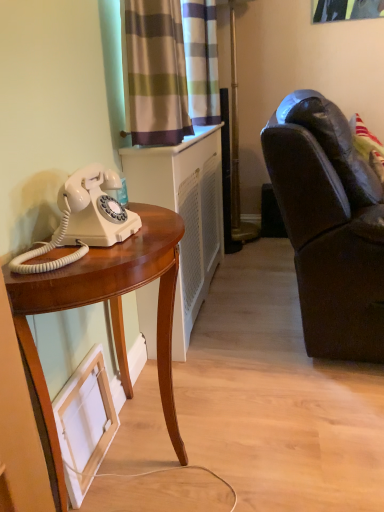
The width and height of the screenshot is (384, 512). In order to click on unoccupied region to the right of white matte picture frame at lower left in this screenshot , I will do `click(146, 460)`.